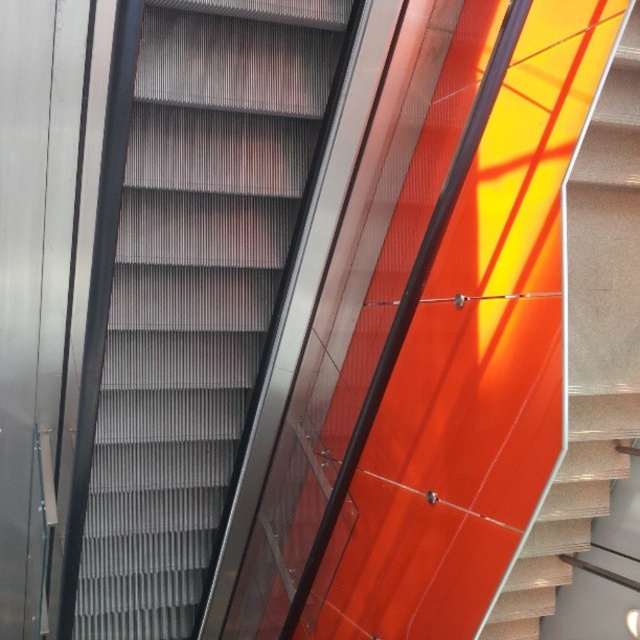
Between point (180, 442) and point (538, 616), which one is positioned behind?

The point (180, 442) is behind.

Can you confirm if metallic gray escalator steps at center is positioned above matte orange wall at right?

Yes.

Is point (248, 189) less distant than point (634, 8)?

No, (248, 189) is further to viewer.

Locate an element on the screen. metallic gray escalator steps at center is located at coordinates (195, 291).